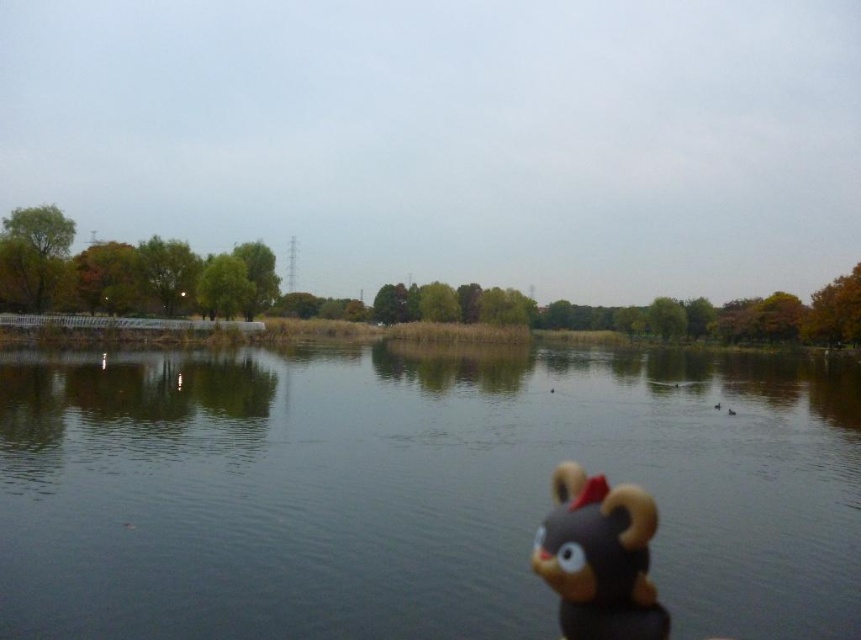
Which is more to the left, transparent water at center or brown matte plush toy at lower right?

Positioned to the left is transparent water at center.

Who is higher up, transparent water at center or brown matte plush toy at lower right?

Positioned higher is brown matte plush toy at lower right.

Find the location of a particular element. This screenshot has width=861, height=640. transparent water at center is located at coordinates (413, 490).